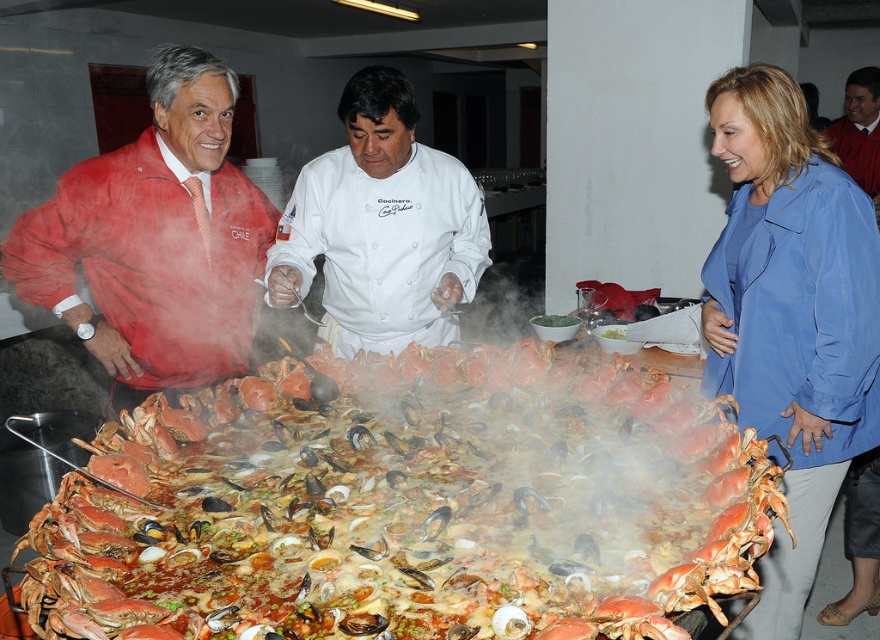
You are a photographer at the event and need to capture both the blue fabric jacket at lower right and the matte red jacket at left in a single frame. Since your camera has a fixed focal length, you can only adjust your distance from the subjects. Which jacket should you move closer to in order to include both in the frame without cropping?

The blue fabric jacket at lower right has a smaller width than the matte red jacket at left. To include both in the frame without cropping, you should move closer to the blue fabric jacket at lower right so that its larger apparent size can balance the composition with the wider matte red jacket at left.

Looking at this image, you are standing in front of the seafood platter and want to take a photo. There are two points of interest marked on the image. The first point is at coordinate point (x=805, y=132) and the second is at coordinate point (x=220, y=116). Which point will appear larger in your photo?

Point (x=805, y=132) is closer to the camera than point (x=220, y=116), so it will appear larger in the photo.